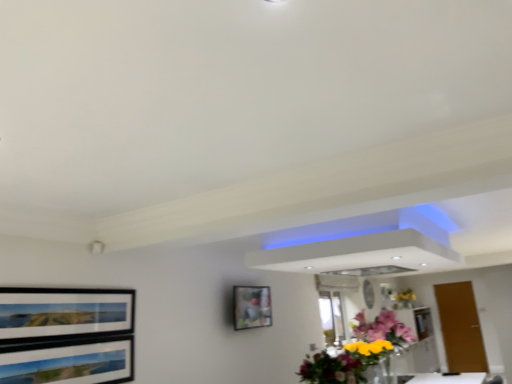
Where is `translucent glass vase at upper right, which appears as the second flower when viewed from the front`? The height and width of the screenshot is (384, 512). translucent glass vase at upper right, which appears as the second flower when viewed from the front is located at coordinates (405, 296).

Is matte black picture frame at center positioned beyond the bounds of translucent glass vase at upper right, positioned as the 2th flower in left-to-right order?

matte black picture frame at center lies outside translucent glass vase at upper right, positioned as the 2th flower in left-to-right order,'s area.

Is point (240, 297) less distant than point (410, 294)?

Yes, point (240, 297) is closer to viewer.

Consider the image. Measure the distance between matte black picture frame at center and translucent glass vase at upper right, which ranks as the 1th flower in back-to-front order.

matte black picture frame at center is 3.13 meters from translucent glass vase at upper right, which ranks as the 1th flower in back-to-front order.

What are the coordinates of `flower above the matte black picture frame at center (from a real-world perspective)` in the screenshot? It's located at (405, 296).

From the matte black picture frame at center, count 1st flower to the right and point to it. Please provide its 2D coordinates.

[(358, 351)]

From a real-world perspective, between matte black picture frame at center and vibrant floral bouquet at center, the first flower in the top-to-bottom sequence, who is vertically lower?

From a 3D spatial view, vibrant floral bouquet at center, the first flower in the top-to-bottom sequence, is below.

From the image's perspective, is matte black picture frame at center located above or below vibrant floral bouquet at center, the first flower in the top-to-bottom sequence?

matte black picture frame at center is situated higher than vibrant floral bouquet at center, the first flower in the top-to-bottom sequence, in the image.

Could you tell me if matte black picture frame at center is facing vibrant floral bouquet at center, which is the 1th flower in left-to-right order?

Yes, matte black picture frame at center is turned towards vibrant floral bouquet at center, which is the 1th flower in left-to-right order.

Is point (313, 368) more distant than point (370, 344)?

No, it is not.

From a real-world perspective, which object rests below the other?

From a 3D spatial view, glossy floral bouquet at center is below.

Considering the relative sizes of vibrant floral bouquet at center, which is the 1th flower from front to back, and glossy floral bouquet at center in the image provided, is vibrant floral bouquet at center, which is the 1th flower from front to back, shorter than glossy floral bouquet at center?

No.

Considering the relative positions of vibrant floral bouquet at center, acting as the second flower starting from the bottom, and glossy floral bouquet at center in the image provided, is vibrant floral bouquet at center, acting as the second flower starting from the bottom, to the left or to the right of glossy floral bouquet at center?

vibrant floral bouquet at center, acting as the second flower starting from the bottom, is to the right of glossy floral bouquet at center.

Locate an element on the screen. This screenshot has height=384, width=512. door that is below the translucent glass vase at upper right, which appears as the second flower when viewed from the front (from the image's perspective) is located at coordinates (x=460, y=327).

Can you confirm if translucent glass vase at upper right, positioned as the 2th flower in left-to-right order, is wider than brown matte door at right?

Yes, translucent glass vase at upper right, positioned as the 2th flower in left-to-right order, is wider than brown matte door at right.

What's the angular difference between translucent glass vase at upper right, positioned as the 2th flower in left-to-right order, and brown matte door at right's facing directions?

They differ by 91.2 degrees in their facing directions.

Is translucent glass vase at upper right, which is the second flower from top to bottom, bigger or smaller than brown matte door at right?

Clearly, translucent glass vase at upper right, which is the second flower from top to bottom, is smaller in size than brown matte door at right.

Is matte black picture frame at center far from glossy floral bouquet at center?

Yes, matte black picture frame at center and glossy floral bouquet at center are quite far apart.

From a real-world perspective, is matte black picture frame at center below glossy floral bouquet at center?

No, from a real-world perspective, matte black picture frame at center is not under glossy floral bouquet at center.

Is matte black picture frame at center bigger than glossy floral bouquet at center?

No.

Is translucent glass vase at upper right, which is the second flower from top to bottom, thinner than vibrant floral bouquet at center, which is the 1th flower from front to back?

Indeed, translucent glass vase at upper right, which is the second flower from top to bottom, has a lesser width compared to vibrant floral bouquet at center, which is the 1th flower from front to back.

From the image's perspective, is translucent glass vase at upper right, which ranks as the 1th flower in back-to-front order, over vibrant floral bouquet at center, which is the 1th flower from front to back?

Actually, translucent glass vase at upper right, which ranks as the 1th flower in back-to-front order, appears below vibrant floral bouquet at center, which is the 1th flower from front to back, in the image.

Measure the distance between translucent glass vase at upper right, positioned as the 2th flower in left-to-right order, and vibrant floral bouquet at center, which is the 1th flower from front to back.

translucent glass vase at upper right, positioned as the 2th flower in left-to-right order, and vibrant floral bouquet at center, which is the 1th flower from front to back, are 11.73 feet apart from each other.

Is translucent glass vase at upper right, which is the second flower from top to bottom, looking in the opposite direction of vibrant floral bouquet at center, the first flower in the top-to-bottom sequence?

That's not correct — translucent glass vase at upper right, which is the second flower from top to bottom, is not looking away from vibrant floral bouquet at center, the first flower in the top-to-bottom sequence.

Can you confirm if translucent glass vase at upper right, which ranks as the 1th flower in back-to-front order, is smaller than glossy floral bouquet at center?

Correct, translucent glass vase at upper right, which ranks as the 1th flower in back-to-front order, occupies less space than glossy floral bouquet at center.

Does translucent glass vase at upper right, which ranks as the 1th flower in back-to-front order, lie in front of glossy floral bouquet at center?

No, it is behind glossy floral bouquet at center.

Which of these two, translucent glass vase at upper right, positioned as the 2th flower in left-to-right order, or glossy floral bouquet at center, is wider?

glossy floral bouquet at center is wider.

Where is `flower behind the matte black picture frame at center`? flower behind the matte black picture frame at center is located at coordinates (405, 296).

Locate an element on the screen. flower that is the 1st one when counting downward from the matte black picture frame at center (from the image's perspective) is located at coordinates coord(358,351).

When comparing their distances from glossy floral bouquet at center, does brown matte door at right or translucent glass vase at upper right, the 1th flower from the right, seem closer?

brown matte door at right is positioned closer to the anchor glossy floral bouquet at center.

Which object lies nearer to the anchor point brown matte door at right, translucent glass vase at upper right, the 1th flower in the bottom-to-top sequence, or vibrant floral bouquet at center, the 2th flower from the back?

Among the two, translucent glass vase at upper right, the 1th flower in the bottom-to-top sequence, is located nearer to brown matte door at right.

Estimate the real-world distances between objects in this image. Which object is further from vibrant floral bouquet at center, the second flower in the right-to-left sequence, glossy floral bouquet at center or brown matte door at right?

The object further to vibrant floral bouquet at center, the second flower in the right-to-left sequence, is brown matte door at right.

Estimate the real-world distances between objects in this image. Which object is further from matte black picture frame at center, vibrant floral bouquet at center, the first flower in the top-to-bottom sequence, or translucent glass vase at upper right, which is the second flower from top to bottom?

translucent glass vase at upper right, which is the second flower from top to bottom, lies further to matte black picture frame at center than the other object.

Looking at the image, which one is located closer to vibrant floral bouquet at center, the second flower in the right-to-left sequence, translucent glass vase at upper right, the 1th flower from the right, or matte black picture frame at center?

matte black picture frame at center lies closer to vibrant floral bouquet at center, the second flower in the right-to-left sequence, than the other object.

Looking at the image, which one is located closer to glossy floral bouquet at center, translucent glass vase at upper right, positioned as the 2th flower in left-to-right order, or brown matte door at right?

Among the two, brown matte door at right is located nearer to glossy floral bouquet at center.

Which object lies nearer to the anchor point glossy floral bouquet at center, matte black picture frame at center or translucent glass vase at upper right, which is the second flower from top to bottom?

The object closer to glossy floral bouquet at center is matte black picture frame at center.

Looking at the image, which one is located closer to glossy floral bouquet at center, translucent glass vase at upper right, the 1th flower from the right, or matte black picture frame at center?

matte black picture frame at center is positioned closer to the anchor glossy floral bouquet at center.

Locate an element on the screen. The width and height of the screenshot is (512, 384). door between glossy floral bouquet at center and translucent glass vase at upper right, the 1th flower from the right, in the front-back direction is located at coordinates (460, 327).

At what (x,y) coordinates should I click in order to perform the action: click on flower between glossy floral bouquet at center and matte black picture frame at center along the z-axis. Please return your answer as a coordinate pair (x, y). The image size is (512, 384). Looking at the image, I should click on (358, 351).

I want to click on picture frame between vibrant floral bouquet at center, acting as the second flower starting from the bottom, and translucent glass vase at upper right, which appears as the second flower when viewed from the front, along the z-axis, so click(251, 307).

Image resolution: width=512 pixels, height=384 pixels. Find the location of `flower between glossy floral bouquet at center and brown matte door at right from front to back`. flower between glossy floral bouquet at center and brown matte door at right from front to back is located at coordinates (358, 351).